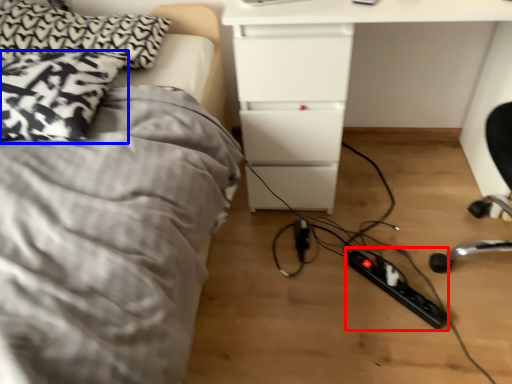
Question: Among these objects, which one is nearest to the camera, extension cord (highlighted by a red box) or pillow (highlighted by a blue box)?

Choices:
 (A) extension cord
 (B) pillow

Answer: (B)